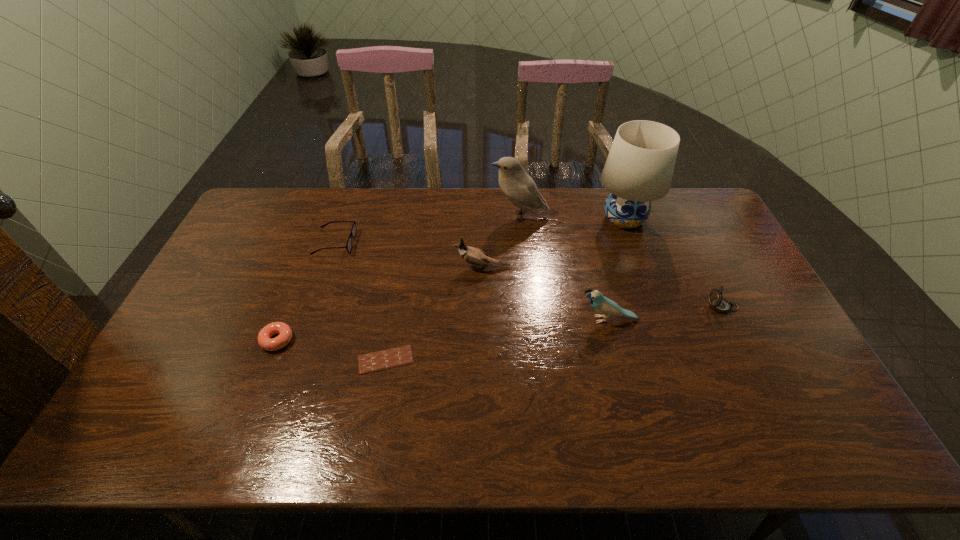
Find the location of a particular element. blank region between the lampshade and the nearest bird is located at coordinates (615, 269).

You are a GUI agent. You are given a task and a screenshot of the screen. Output one action in this format:
    pyautogui.click(x=<x>, y=<y>)
    Task: Click on the vacant area that lies between the shortest object and the rightmost bird
    This screenshot has width=960, height=540.
    Given the screenshot: What is the action you would take?
    pyautogui.click(x=496, y=340)

The image size is (960, 540). I want to click on empty space between the seventh shortest object and the lampshade, so click(571, 218).

Identify the location of vacant region between the tallest bird and the tallest object. (571, 218).

Image resolution: width=960 pixels, height=540 pixels. What are the coordinates of `free area in between the tallest object and the spectacles` in the screenshot? It's located at (479, 231).

Locate an element on the screen. vacant area that lies between the lampshade and the fourth farthest object is located at coordinates (553, 244).

In order to click on free space between the rightmost bird and the compass in this screenshot , I will do `click(665, 313)`.

Identify which object is located as the nearest to the rightmost object. Please provide its 2D coordinates. Your answer should be formatted as a tuple, i.e. [(x, y)], where the tuple contains the x and y coordinates of a point satisfying the conditions above.

[(601, 304)]

Where is `object that ranks as the third closest to the rightmost bird`? This screenshot has height=540, width=960. object that ranks as the third closest to the rightmost bird is located at coordinates (639, 168).

Where is `the second closest bird relative to the nearest bird`? The image size is (960, 540). the second closest bird relative to the nearest bird is located at coordinates (521, 190).